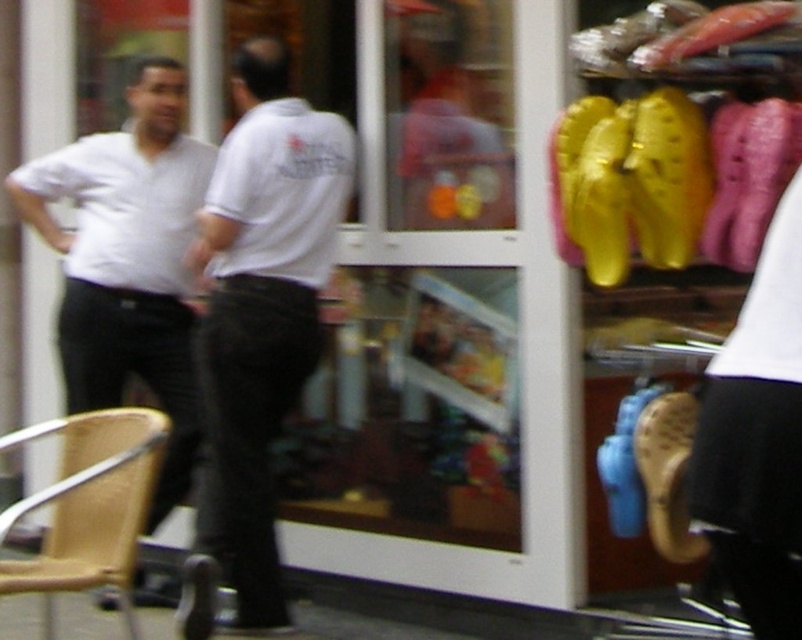
Which is more to the right, white matte shirt at left or wooden chair at lower left?

wooden chair at lower left is more to the right.

From the picture: Which is above, white matte shirt at left or wooden chair at lower left?

white matte shirt at left is higher up.

Measure the distance between white matte shirt at left and camera.

They are 5.04 meters apart.

Find the location of `white matte shirt at left`. white matte shirt at left is located at coordinates (128, 260).

Can you confirm if white matte shirt at center is smaller than wooden chair at lower left?

Indeed, white matte shirt at center has a smaller size compared to wooden chair at lower left.

Is white matte shirt at center shorter than wooden chair at lower left?

No.

Who is more forward, (266, 80) or (106, 481)?

Point (106, 481) is in front.

Image resolution: width=802 pixels, height=640 pixels. I want to click on white matte shirt at center, so click(x=262, y=308).

Does white matte shirt at center have a greater height compared to white matte shirt at left?

Yes.

Does white matte shirt at center have a smaller size compared to white matte shirt at left?

No, white matte shirt at center is not smaller than white matte shirt at left.

Between point (233, 225) and point (188, 387), which one is positioned in front?

Point (233, 225) is more forward.

Identify the location of white matte shirt at center. (262, 308).